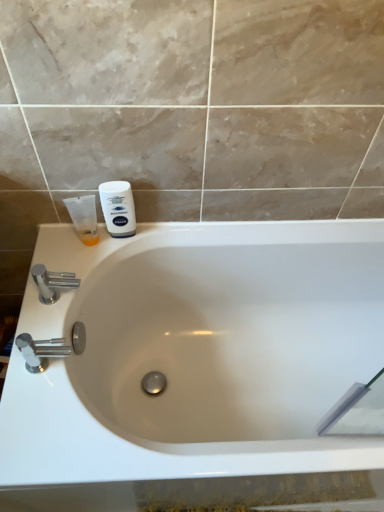
Find the location of a particular element. The width and height of the screenshot is (384, 512). vacant space behind chrome metallic faucet at left, arranged as the 1th tap when viewed from the back is located at coordinates (76, 257).